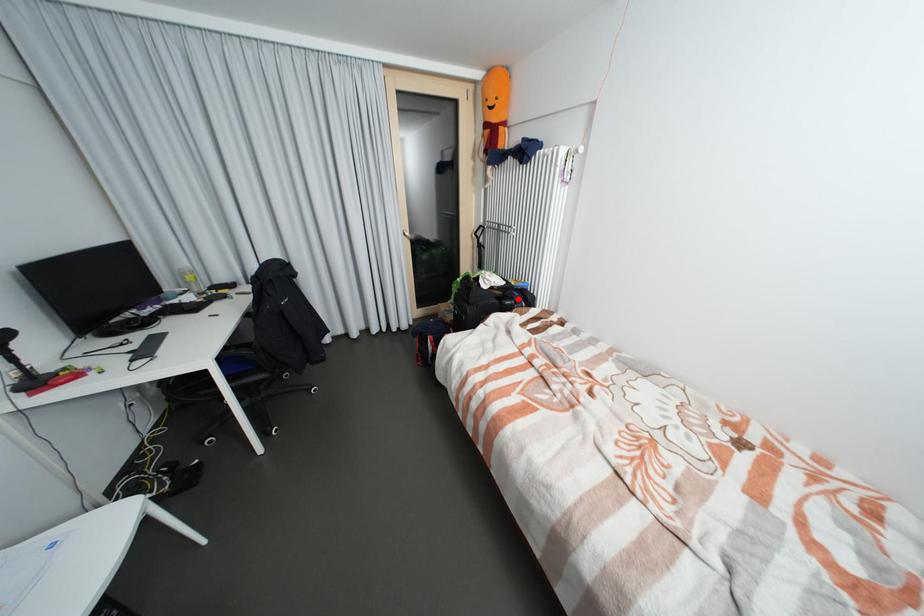
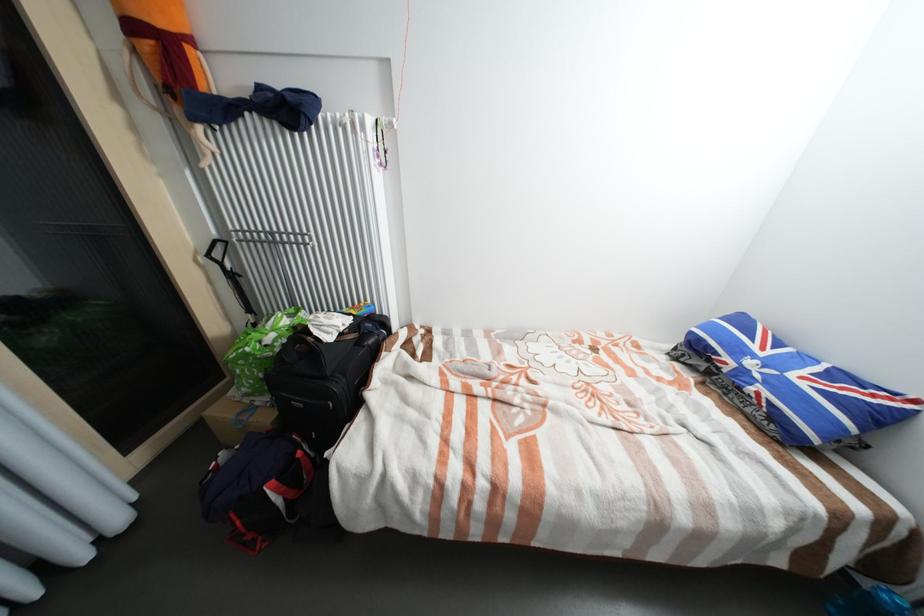
Question: I am providing you with two images of the same scene from different viewpoints. Given a red point in image1, look at the same physical point in image2. Is it:

Choices:
 (A) Closer to the viewpoint
 (B) Farther from the viewpoint

Answer: (A)